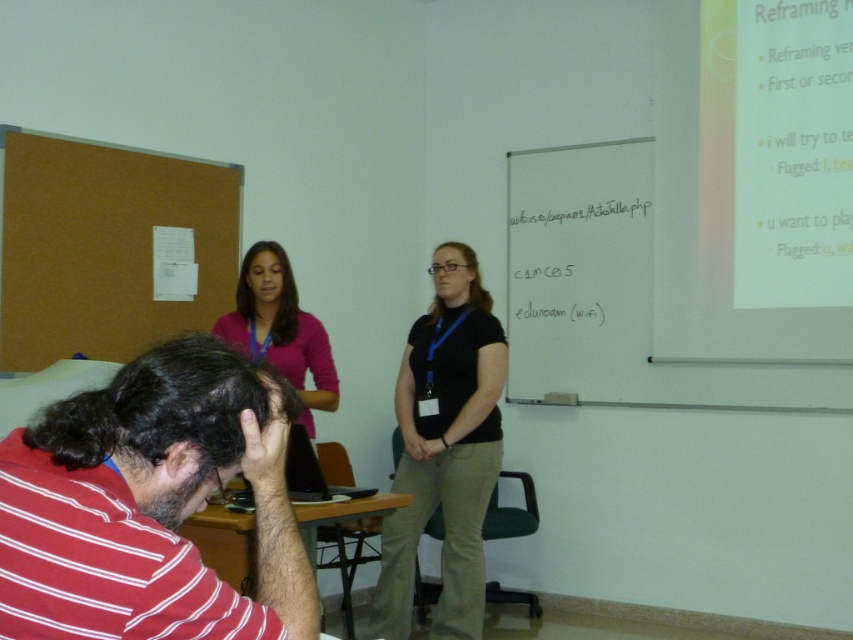
Question: Considering the real-world distances, which object is closest to the black matte shirt at center?

Choices:
 (A) whiteboard at right
 (B) red striped shirt at lower left

Answer: (A)

Question: Is red striped shirt at lower left below black matte shirt at center?

Choices:
 (A) no
 (B) yes

Answer: (A)

Question: Estimate the real-world distances between objects in this image. Which object is farther from the pink fabric shirt at upper center?

Choices:
 (A) whiteboard at right
 (B) red striped shirt at lower left

Answer: (B)

Question: Does black matte shirt at center have a larger size compared to pink fabric shirt at upper center?

Choices:
 (A) yes
 (B) no

Answer: (A)

Question: Does black matte shirt at center appear under pink fabric shirt at upper center?

Choices:
 (A) no
 (B) yes

Answer: (B)

Question: Which object is closer to the camera taking this photo?

Choices:
 (A) black matte shirt at center
 (B) whiteboard at right
 (C) red striped shirt at lower left

Answer: (C)